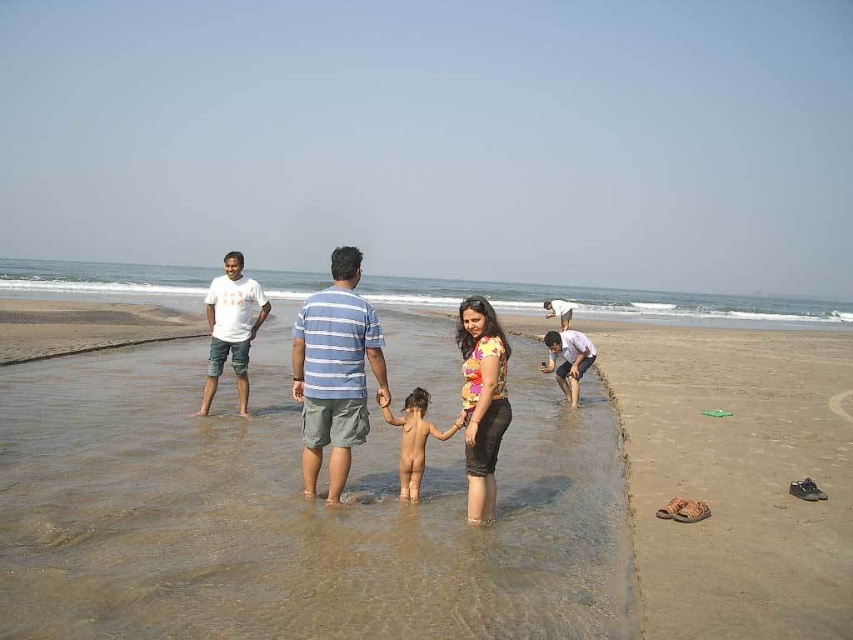
Is white cotton t-shirt at left positioned at the back of smooth skin child at center?

No.

Is point (260, 323) closer to camera compared to point (560, 362)?

Yes, it is in front of point (560, 362).

Which is in front, point (236, 376) or point (575, 394)?

Point (236, 376)

Locate an element on the screen. The image size is (853, 640). white cotton t-shirt at left is located at coordinates (231, 326).

Who is higher up, brown sand at center or nude skin at center?

nude skin at center

Describe the element at coordinates (436, 502) in the screenshot. I see `brown sand at center` at that location.

Find the location of a particular element. The height and width of the screenshot is (640, 853). brown sand at center is located at coordinates (436, 502).

The image size is (853, 640). In order to click on brown sand at center in this screenshot , I will do `click(436, 502)`.

Who is more forward, (403, 468) or (561, 372)?

Point (403, 468)

Who is higher up, nude skin at center or smooth skin child at center?

smooth skin child at center is higher up.

Which is behind, point (409, 435) or point (579, 342)?

Positioned behind is point (579, 342).

Locate an element on the screen. The image size is (853, 640). nude skin at center is located at coordinates (415, 440).